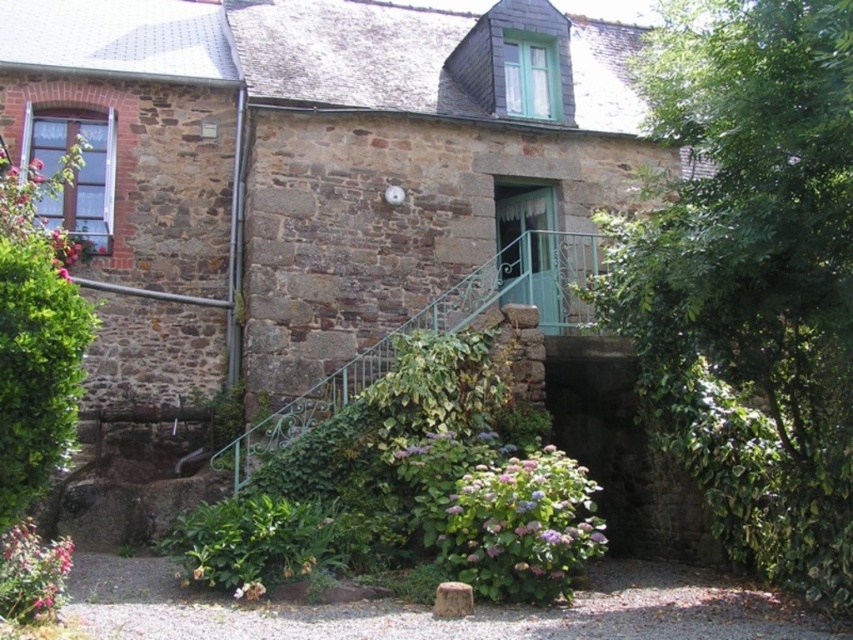
You are a gardener who wants to install a new sprinkler system between the green leafy tree at center and the purple matte flower at lower center. The sprinkler system requires a minimum distance of 15 meters between the two points to function properly. Based on the scene, can the sprinkler system be installed between these two objects?

The distance between the green leafy tree at center and the purple matte flower at lower center is 17.73 meters, which exceeds the minimum requirement of 15 meters. Therefore, the sprinkler system can be installed between these two objects.

You are standing at the base of the stone house and want to reach the green stone door at center. Which direction should you move relative to the pink matte flower at lower left?

The green stone door at center is above the pink matte flower at lower left, so you should move upward from the pink matte flower at lower left to reach the green stone door at center.

Consider the image. You are a gardener standing at the base of the stone house. You need to water both the green leafy bush at lower center and the purple matte flower at lower center. Which one should you water first if you want to reach the one that is closer to the ground?

The purple matte flower at lower center is closer to the ground because the green leafy bush at lower center is positioned over it.